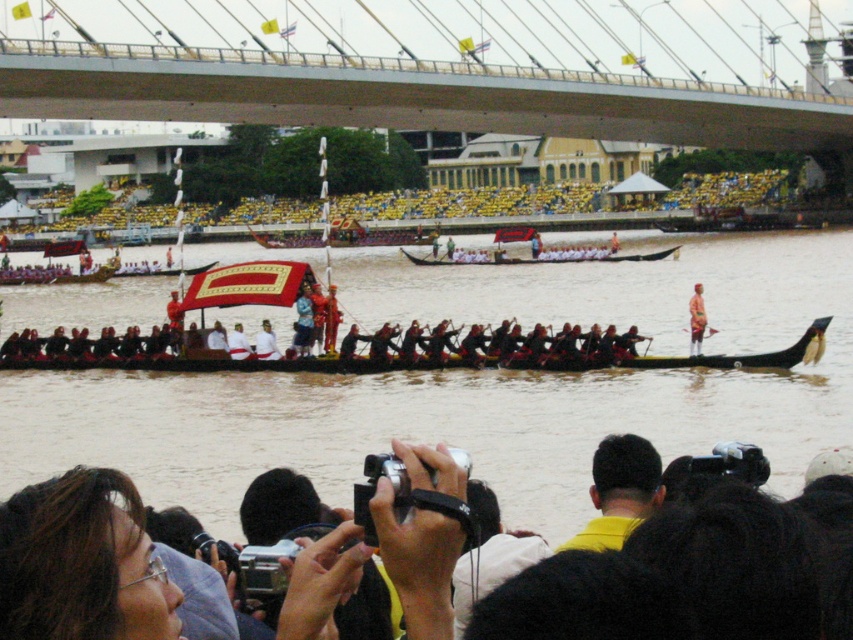
Question: Can you confirm if brown water at center is positioned above yellow plastic seats at upper center?

Choices:
 (A) no
 (B) yes

Answer: (A)

Question: Among these points, which one is farthest from the camera?

Choices:
 (A) (788, 259)
 (B) (506, 205)
 (C) (693, 346)
 (D) (564, 547)

Answer: (B)

Question: Estimate the real-world distances between objects in this image. Which object is farther from the black glossy boat at center?

Choices:
 (A) orange fabric person at center
 (B) brown water at center
 (C) yellow plastic seats at upper center
 (D) yellow fabric head at center

Answer: (C)

Question: Does black glossy boat at center have a smaller size compared to white glossy canoe at center?

Choices:
 (A) yes
 (B) no

Answer: (B)

Question: Where is orange fabric person at center located in relation to red velvet robe at center in the image?

Choices:
 (A) above
 (B) below

Answer: (A)

Question: Which object is positioned closest to the orange fabric person at center?

Choices:
 (A) yellow plastic seats at upper center
 (B) black glossy boat at center

Answer: (B)